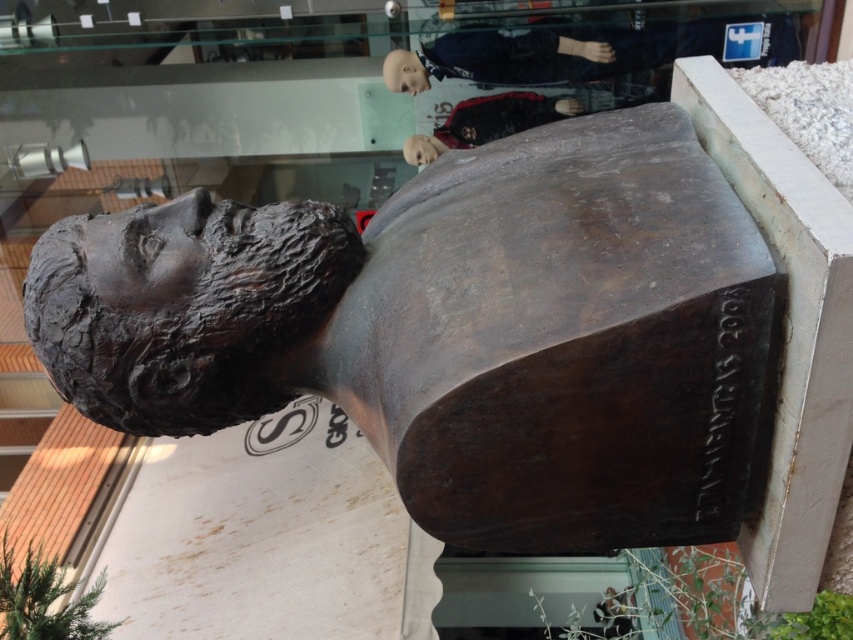
Question: Can you confirm if bronze sculpture at center is smaller than matte plastic head at upper center?

Choices:
 (A) no
 (B) yes

Answer: (A)

Question: Is dark blue fabric mannequin at upper center in front of matte plastic head at upper center?

Choices:
 (A) no
 (B) yes

Answer: (B)

Question: Which of the following is the farthest from the observer?

Choices:
 (A) bronze statue at upper center
 (B) dark blue fabric mannequin at upper center

Answer: (A)

Question: Which point appears farthest from the camera in this image?

Choices:
 (A) (282, 224)
 (B) (439, 150)
 (C) (236, 289)
 (D) (386, 64)

Answer: (B)

Question: Where is bronze statue at center located in relation to matte plastic head at upper center in the image?

Choices:
 (A) right
 (B) left

Answer: (A)

Question: Which object is the farthest from the bronze statue at upper center?

Choices:
 (A) bronze statue at center
 (B) matte plastic head at upper center
 (C) bronze sculpture at center
 (D) dark blue fabric mannequin at upper center

Answer: (C)